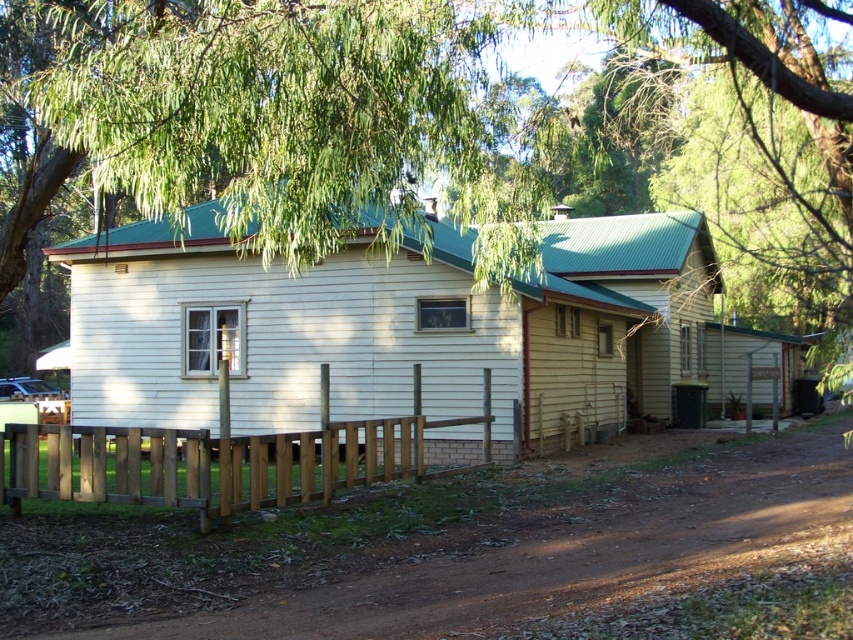
Does brown dirt track at lower center have a lesser width compared to brown wooden fence at lower center?

No, brown dirt track at lower center is not thinner than brown wooden fence at lower center.

At what (x,y) coordinates should I click in order to perform the action: click on brown dirt track at lower center. Please return your answer as a coordinate pair (x, y). Looking at the image, I should click on (419, 547).

I want to click on brown dirt track at lower center, so click(419, 547).